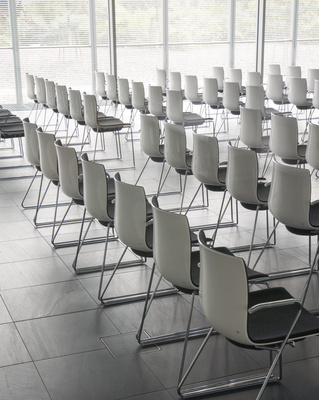
Where is `chair in front two row`? The height and width of the screenshot is (400, 319). chair in front two row is located at coordinates (220, 72), (234, 70), (250, 76), (271, 82), (296, 92), (314, 90), (314, 74), (295, 72), (276, 68).